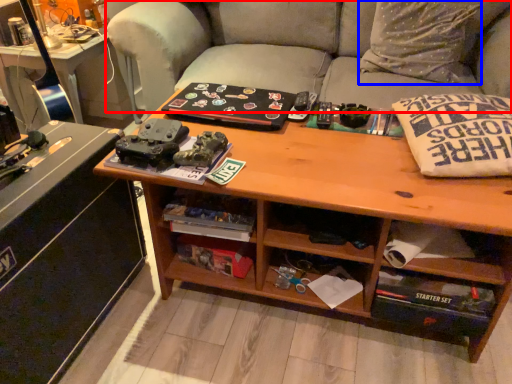
Question: Which of the following is the farthest to the observer, studio couch (highlighted by a red box) or throw pillow (highlighted by a blue box)?

Choices:
 (A) studio couch
 (B) throw pillow

Answer: (B)